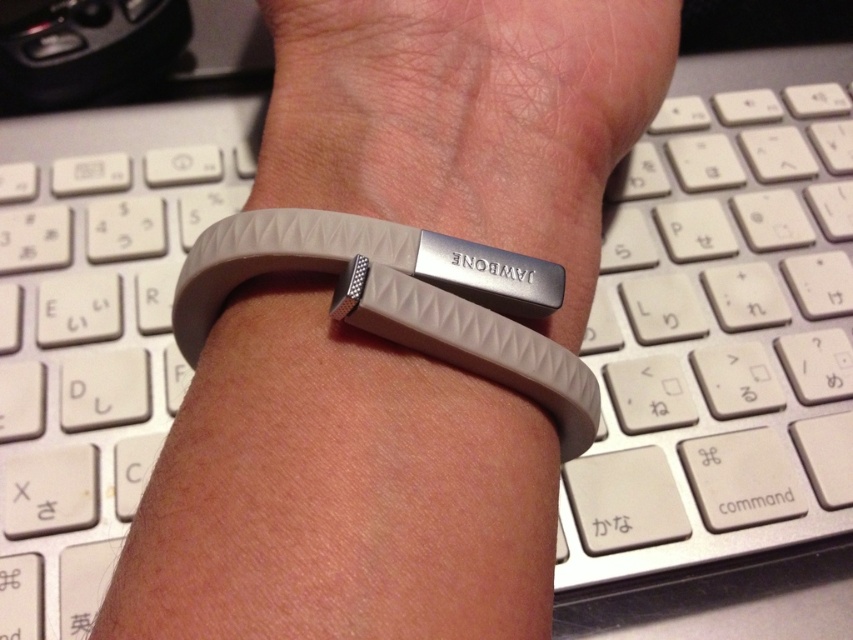
You are trying to determine which wristband is on the right side. You see a matte gray wristband at center and a gray rubber wristband at center. Which one is located to the right?

The matte gray wristband at center is positioned on the right side of the gray rubber wristband at center.

Consider the image. You are a photographer trying to capture a close shot of the matte gray wristband at center. Since the white plastic keyboard at center is in the background, will you need to adjust your camera focus to ensure the wristband is sharp?

Yes, you need to adjust the camera focus to the matte gray wristband at center because it is in front of the white plastic keyboard at center, ensuring the wristband remains the main focus and appears sharp.

You are trying to decide between two wristbands for your fitness tracker. You notice the matte gray wristband at center and the gray rubber wristband at center in the image. Which one is wider?

The matte gray wristband at center is wider than the gray rubber wristband at center.